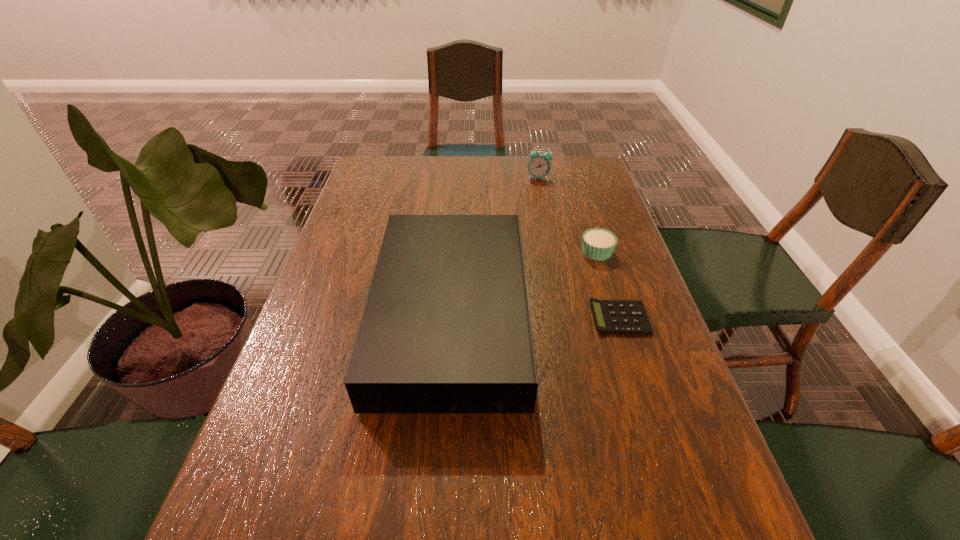
Find the location of a particular element. free point that satisfies the following two spatial constraints: 1. on the face of the farthest object; 2. on the right side of the cupcake is located at coordinates (553, 252).

Find the location of a particular element. The image size is (960, 540). blank area in the image that satisfies the following two spatial constraints: 1. on the face of the third object from right to left; 2. at the front of the CD player for disc insertion is located at coordinates (565, 315).

At what (x,y) coordinates should I click in order to perform the action: click on vacant space that satisfies the following two spatial constraints: 1. at the front of the CD player for disc insertion; 2. on the back side of the calculator. Please return your answer as a coordinate pair (x, y). The height and width of the screenshot is (540, 960). Looking at the image, I should click on (451, 318).

The height and width of the screenshot is (540, 960). Identify the location of free space that satisfies the following two spatial constraints: 1. at the front of the leftmost object for disc insertion; 2. on the right side of the calculator. (451, 318).